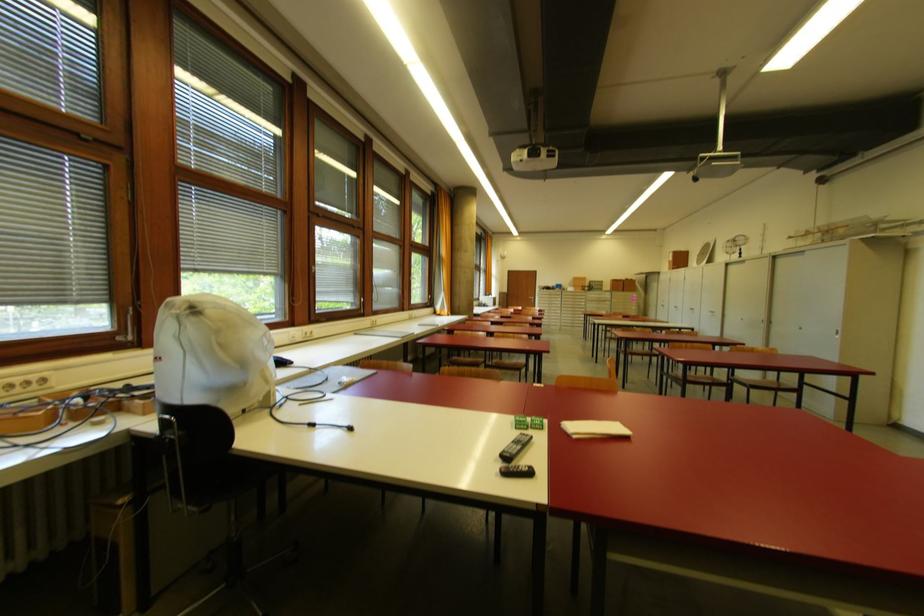
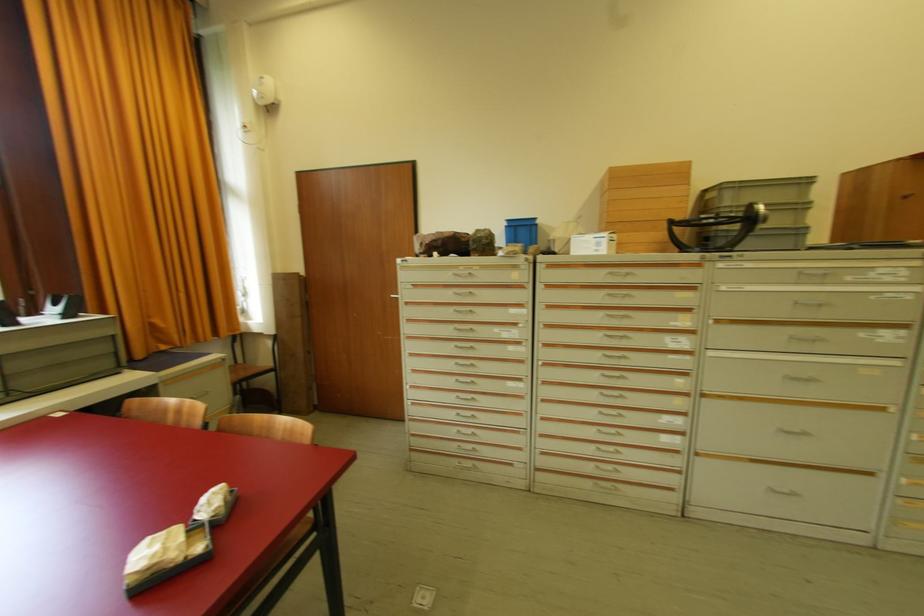
The point at (578,292) is marked in the first image. Where is the corresponding point in the second image?

(623, 248)